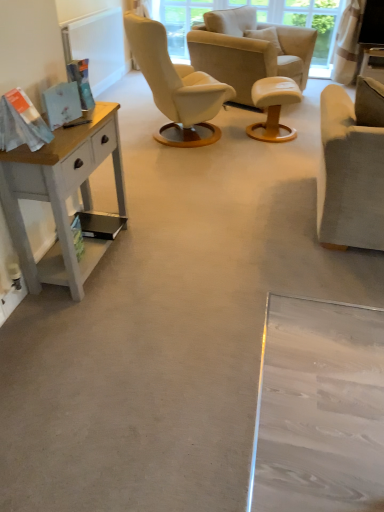
Locate an element on the screen. The image size is (384, 512). vacant space that's between white painted wood desk at left and suede beige armchair at right, the 1th chair in the bottom-to-top sequence is located at coordinates (220, 236).